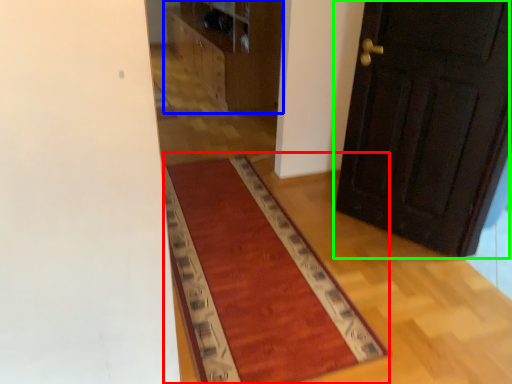
Question: Estimate the real-world distances between objects in this image. Which object is closer to mat (highlighted by a red box), dresser (highlighted by a blue box) or door (highlighted by a green box)?

Choices:
 (A) dresser
 (B) door

Answer: (B)